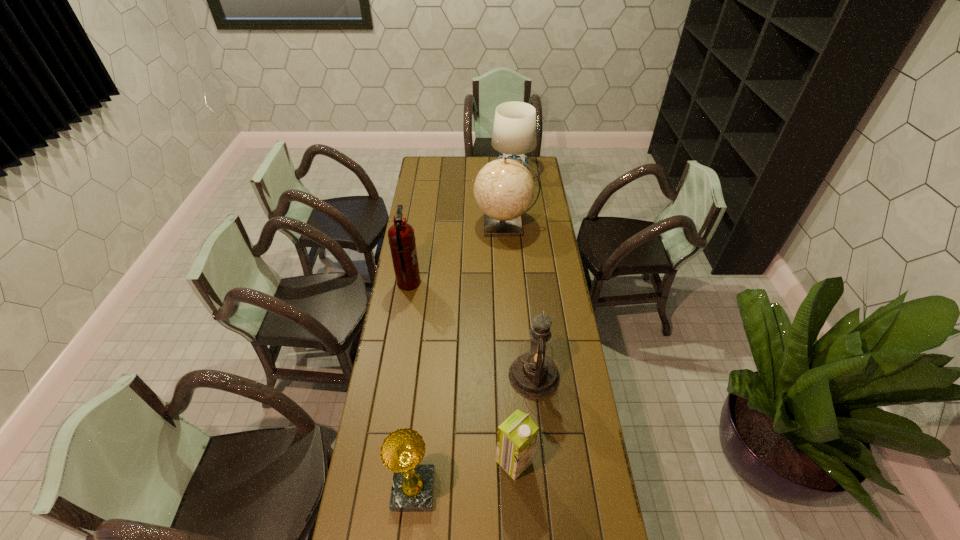
Where is `globe`? Image resolution: width=960 pixels, height=540 pixels. globe is located at coordinates (504, 189).

Where is `lampshade`? lampshade is located at coordinates (514, 132).

The height and width of the screenshot is (540, 960). In order to click on the leftmost object in this screenshot , I will do `click(401, 236)`.

The width and height of the screenshot is (960, 540). Identify the location of the third farthest object. (401, 236).

The width and height of the screenshot is (960, 540). I want to click on oil lamp, so 533,374.

Identify the location of the fifth object from right to left. (402, 451).

Image resolution: width=960 pixels, height=540 pixels. I want to click on soya milk, so click(516, 438).

Where is `vacant area located 0.190m on the surface of the globe showing Europe and Africa`? The width and height of the screenshot is (960, 540). vacant area located 0.190m on the surface of the globe showing Europe and Africa is located at coordinates (438, 224).

You are a GUI agent. You are given a task and a screenshot of the screen. Output one action in this format:
    pyautogui.click(x=<x>, y=<y>)
    Task: Click on the free space located 0.350m on the surface of the globe showing Europe and Africa
    The height and width of the screenshot is (540, 960).
    Given the screenshot: What is the action you would take?
    pyautogui.click(x=408, y=224)

This screenshot has width=960, height=540. Identify the location of free space located 0.120m on the surface of the globe showing Europe and Africa. (451, 224).